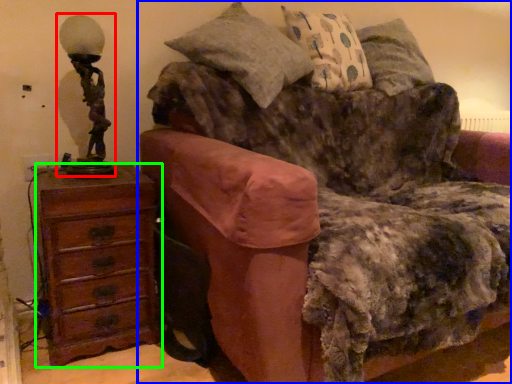
Question: Which is farther away from table lamp (highlighted by a red box)? studio couch (highlighted by a blue box) or chest of drawers (highlighted by a green box)?

Choices:
 (A) studio couch
 (B) chest of drawers

Answer: (A)